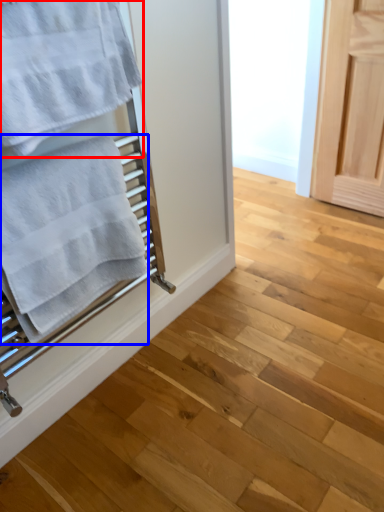
Question: Which object is closer to the camera taking this photo, towel (highlighted by a red box) or towel (highlighted by a blue box)?

Choices:
 (A) towel
 (B) towel

Answer: (A)